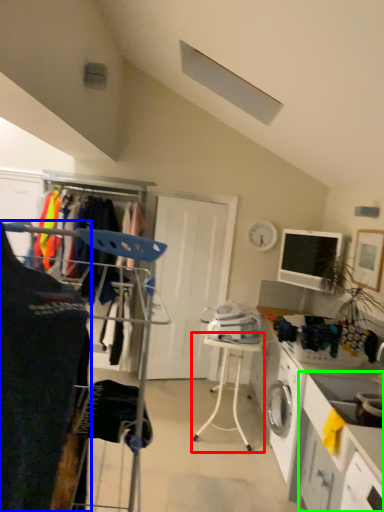
Question: Considering the real-world distances, which object is closest to table (highlighted by a red box)? clothing (highlighted by a blue box) or counter (highlighted by a green box).

Choices:
 (A) clothing
 (B) counter

Answer: (B)